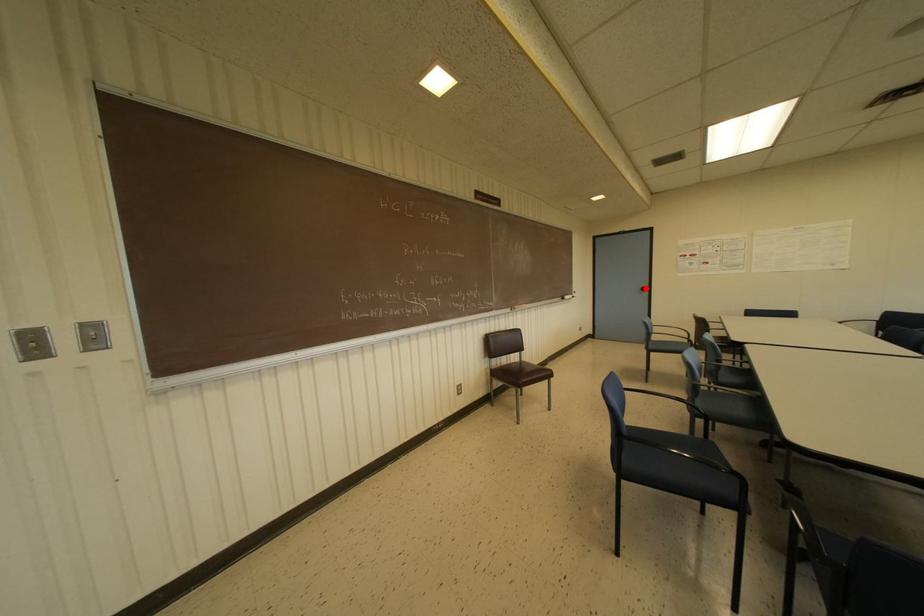
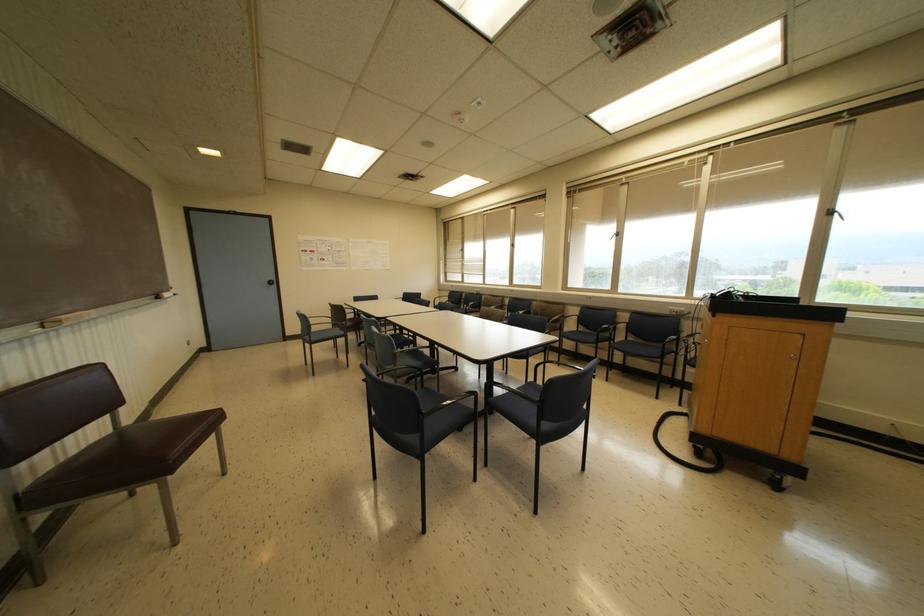
Question: I am providing you with two images of the same scene from different viewpoints. A red point is marked on the first image. Can you still see the location of the red point in image 2?

Choices:
 (A) Yes
 (B) No

Answer: (A)